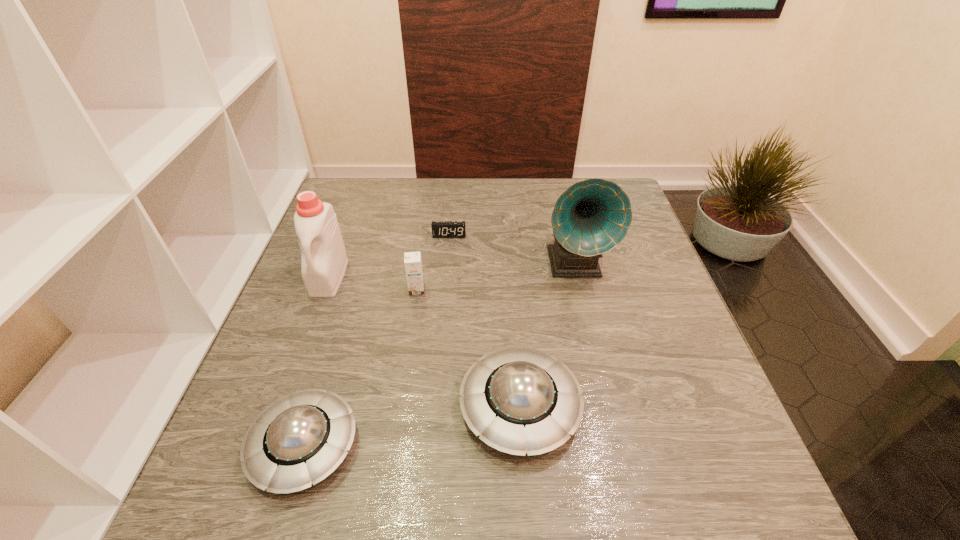
Where is `free space between the phonograph_record and the third object from left to right`? free space between the phonograph_record and the third object from left to right is located at coordinates (495, 277).

Identify the location of free space between the detergent and the shorter saucer. (317, 361).

Locate which object ranks fourth in proximity to the detergent. Please provide its 2D coordinates. Your answer should be formatted as a tuple, i.e. [(x, y)], where the tuple contains the x and y coordinates of a point satisfying the conditions above.

[(521, 400)]

Locate which object ranks fourth in proximity to the taller saucer. Please provide its 2D coordinates. Your answer should be formatted as a tuple, i.e. [(x, y)], where the tuple contains the x and y coordinates of a point satisfying the conditions above.

[(324, 260)]

Where is `vacant position in the image that satisfies the following two spatial constraints: 1. on the back side of the second shortest object; 2. on the right side of the right saucer`? vacant position in the image that satisfies the following two spatial constraints: 1. on the back side of the second shortest object; 2. on the right side of the right saucer is located at coordinates [x=316, y=407].

Identify the location of vacant area that satisfies the following two spatial constraints: 1. on the handle side of the fourth object from right to left; 2. on the right side of the detergent. This screenshot has height=540, width=960. (324, 289).

At what (x,y) coordinates should I click in order to perform the action: click on free point that satisfies the following two spatial constraints: 1. on the front-facing side of the right saucer; 2. on the right side of the fourth object from left to right. Please return your answer as a coordinate pair (x, y). The width and height of the screenshot is (960, 540). Looking at the image, I should click on (435, 407).

What are the coordinates of `vacant position in the image that satisfies the following two spatial constraints: 1. on the handle side of the right saucer; 2. on the right side of the second tallest object` in the screenshot? It's located at (281, 407).

Locate an element on the screen. This screenshot has height=540, width=960. free space that satisfies the following two spatial constraints: 1. on the front-facing side of the shortest object; 2. on the left side of the right saucer is located at coordinates (435, 407).